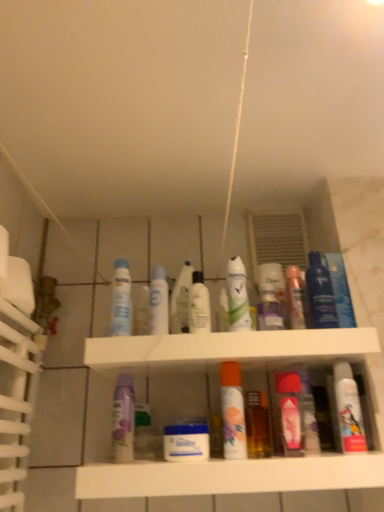
Question: Would you say blue glossy mouthwash at upper right, which ranks as the 9th mouthwash in left-to-right order, is to the left or to the right of matte purple lotion at center, which is the 2th toiletry from right to left, in the picture?

Choices:
 (A) right
 (B) left

Answer: (A)

Question: Considering the positions of blue glossy mouthwash at upper right, the 2th mouthwash positioned from the right, and matte purple lotion at center, which is the 2th toiletry from right to left, in the image, is blue glossy mouthwash at upper right, the 2th mouthwash positioned from the right, wider or thinner than matte purple lotion at center, which is the 2th toiletry from right to left,?

Choices:
 (A) thin
 (B) wide

Answer: (B)

Question: Considering the real-world distances, which object is farthest from the matte white spray can at center, placed as the 2th cleaning product when sorted from right to left?

Choices:
 (A) pink glossy mouthwash at center, placed as the third mouthwash when sorted from right to left
 (B) purple matte mouthwash at center, the tenth mouthwash from the right
 (C) blue glossy mouthwash at upper right, the 2th mouthwash positioned from the right
 (D) white glossy mouthwash at center, arranged as the 7th mouthwash when viewed from the left
 (E) white glossy mouthwash at center, arranged as the 9th mouthwash when viewed from the right

Answer: (A)

Question: Which is nearer to the pink glossy mouthwash at center, placed as the third mouthwash when sorted from right to left?

Choices:
 (A) matte purple lotion at center, the 1th toiletry positioned from the left
 (B) blue glossy mouthwash at upper right, which ranks as the 9th mouthwash in left-to-right order
 (C) white glossy mouthwash at center, the fourth mouthwash viewed from the right
 (D) matte pink spray can at center, positioned as the second cleaning product in left-to-right order
 (E) white glossy mouthwash at center, the 8th mouthwash positioned from the right

Answer: (D)